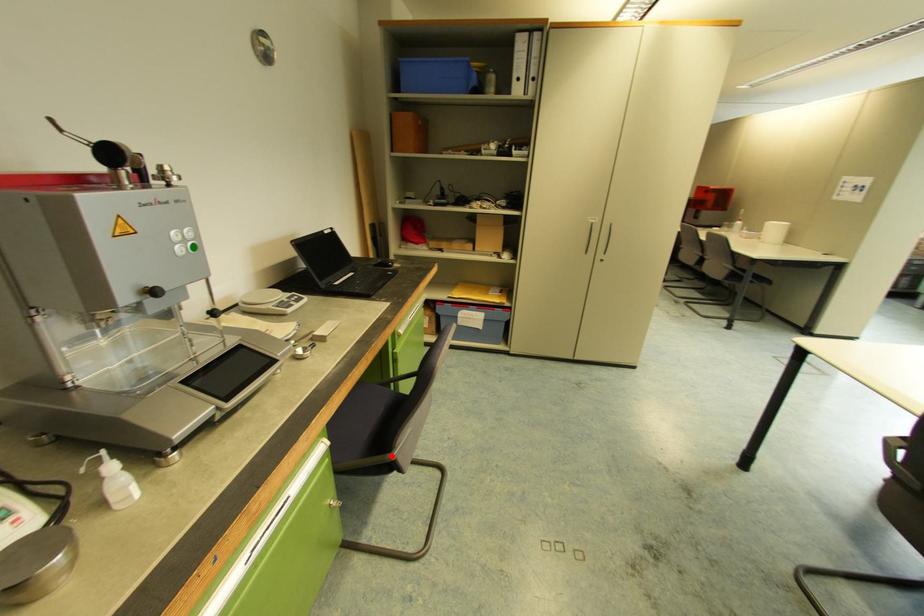
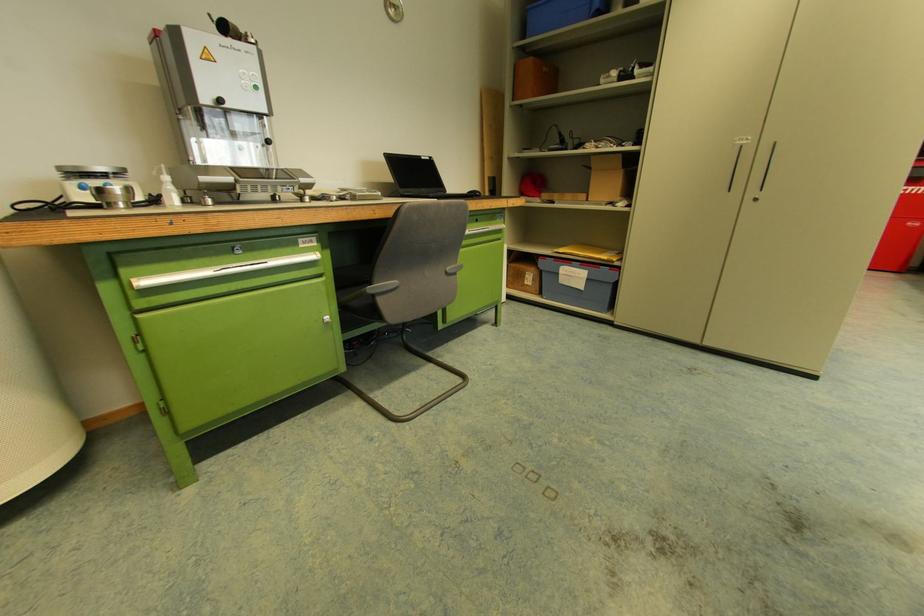
Where in the second image is the point corresponding to the highlighted location from the first image?

(368, 290)